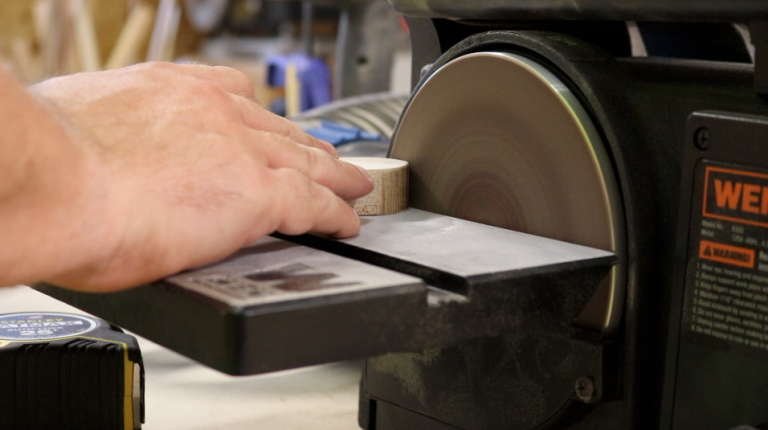
Find the location of `floor`. floor is located at coordinates (259, 384).